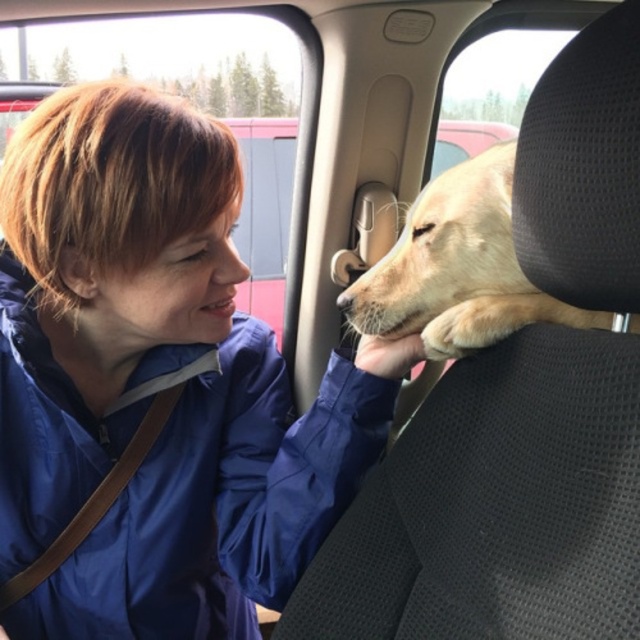
You are a passenger in a car and want to know if you can fully see the golden fur dog at center through the transparent glass window at upper center. Based on their widths, can you see the entire dog?

The transparent glass window at upper center is wider than the golden fur dog at center, so yes, you can see the entire golden fur dog at center through the window.

You are a passenger in a car and see the golden fur dog at center and the transparent glass window at upper center. Which object is closer to you from your seating position?

The golden fur dog at center is closer to you than the transparent glass window at upper center because the dog is behind the window.

You are a passenger in the car and want to let some fresh air in. The transparent glass window at upper center and the golden fur dog at center are in your view. Which object can you open to allow airflow?

The transparent glass window at upper center can be opened to allow airflow, as it is above the golden fur dog at center and typically windows in cars are operable.